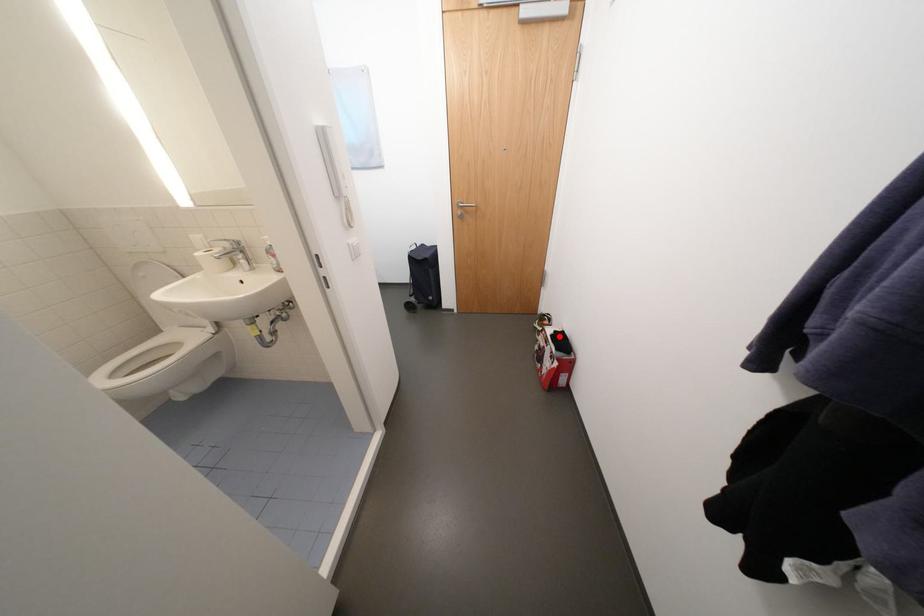
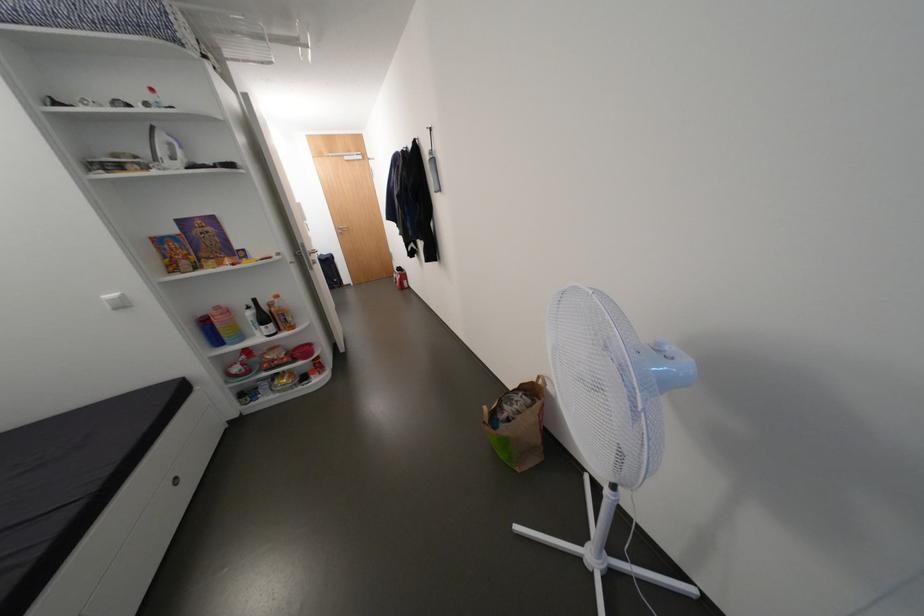
The point at the highlighted location is marked in the first image. Where is the corresponding point in the second image?

(405, 270)